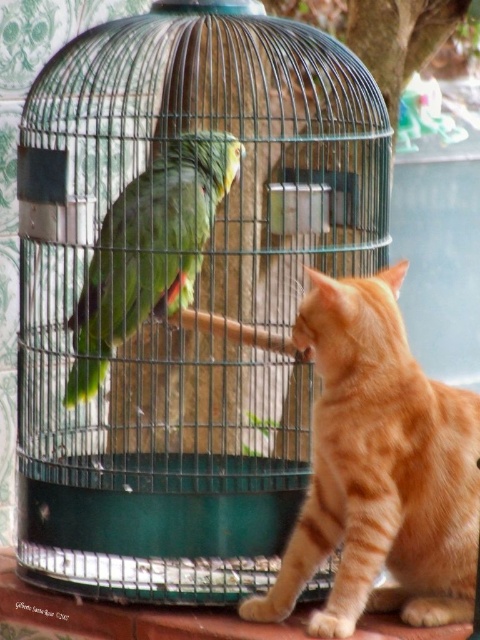
Who is positioned more to the left, orange tabby cat at right or green matte parrot at center?

green matte parrot at center is more to the left.

Does orange tabby cat at right have a larger size compared to green matte parrot at center?

Correct, orange tabby cat at right is larger in size than green matte parrot at center.

Is point (279, 609) positioned in front of point (108, 259)?

Yes, it is in front of point (108, 259).

Find the location of a particular element. This screenshot has width=480, height=640. orange tabby cat at right is located at coordinates (380, 468).